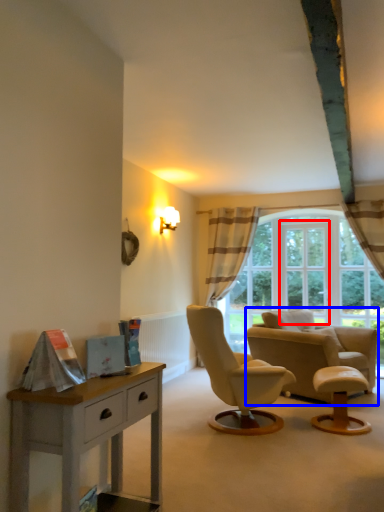
Question: Which point is closer to the camera, window frame (highlighted by a red box) or chair (highlighted by a blue box)?

Choices:
 (A) window frame
 (B) chair

Answer: (B)